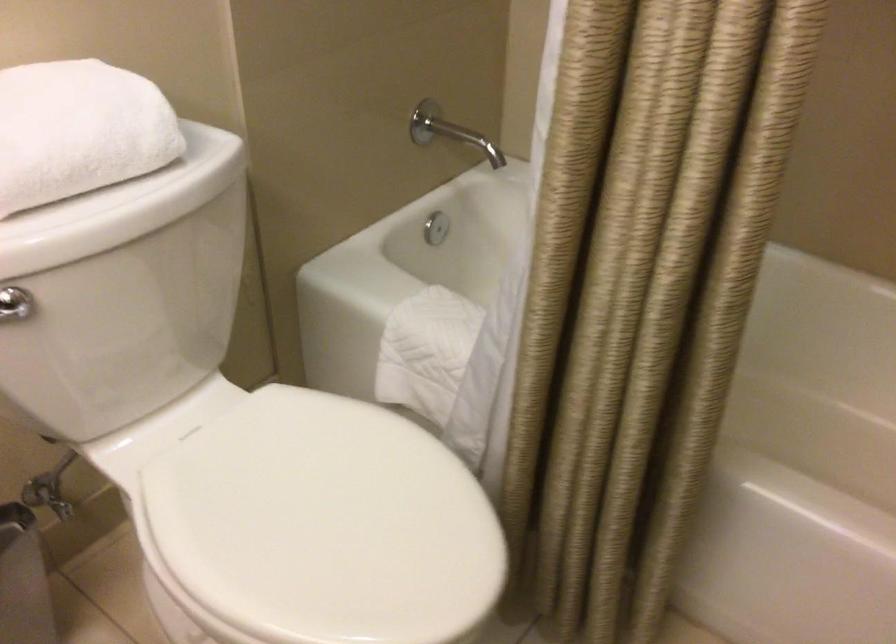
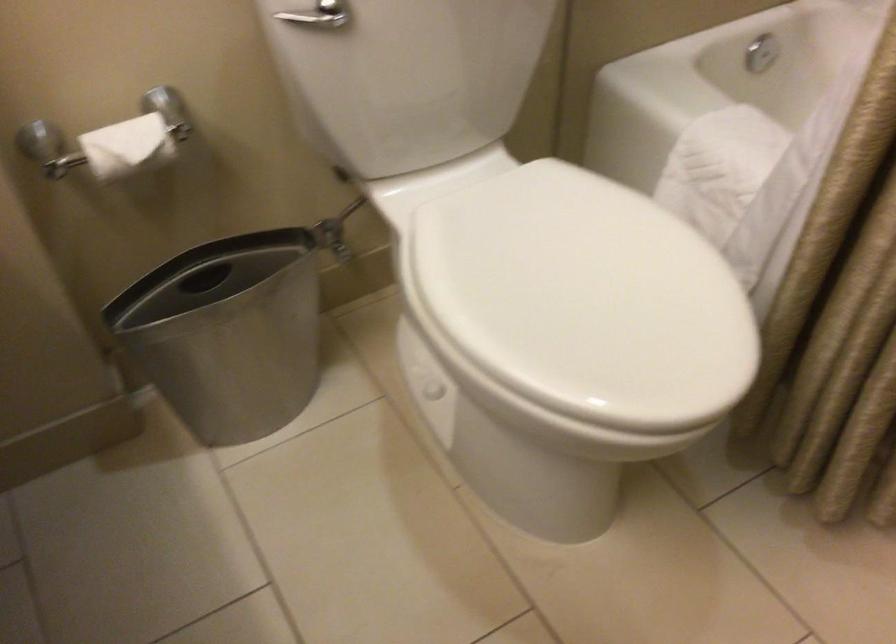
The point at (x=108, y=341) is marked in the first image. Where is the corresponding point in the second image?

(407, 77)